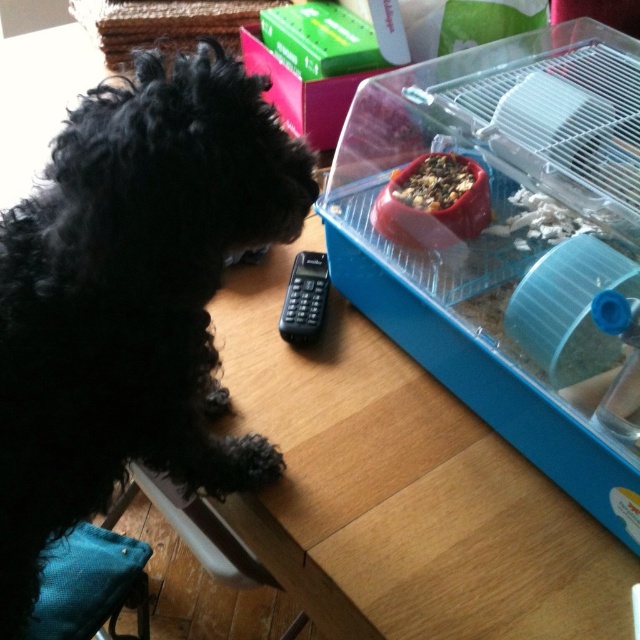
Measure the distance between transparent plastic bird cage at right and wooden table at lower left.

A distance of 21.36 centimeters exists between transparent plastic bird cage at right and wooden table at lower left.

Which is in front, point (630, 456) or point (368, 620)?

Point (630, 456) is in front.

Does point (376, 180) come closer to viewer compared to point (353, 540)?

No, (376, 180) is behind (353, 540).

Locate an element on the screen. Image resolution: width=640 pixels, height=640 pixels. transparent plastic bird cage at right is located at coordinates (509, 243).

Is black curly fur dog at left bigger than brown textured food at center?

Indeed, black curly fur dog at left has a larger size compared to brown textured food at center.

Who is more distant from viewer, (172, 296) or (420, 177)?

The point (420, 177) is behind.

Identify the location of black curly fur dog at left. (132, 298).

Does transparent plastic bird cage at right lie behind brown textured food at center?

That is False.

Is point (637, 508) farther from viewer compared to point (458, 184)?

No.

Measure the distance between transparent plastic bird cage at right and camera.

transparent plastic bird cage at right and camera are 25.99 inches apart.

Where is `transparent plastic bird cage at right`? This screenshot has width=640, height=640. transparent plastic bird cage at right is located at coordinates (509, 243).